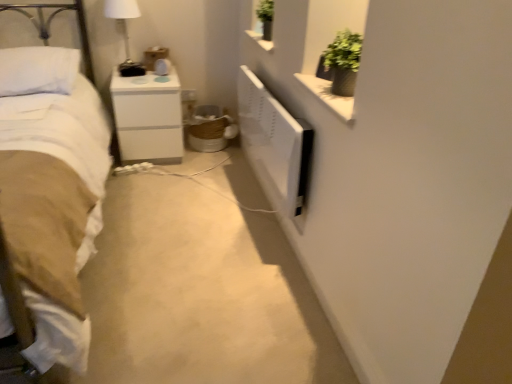
Question: Is there a large distance between white glossy nightstand at center and white soft bed at left?

Choices:
 (A) no
 (B) yes

Answer: (A)

Question: Is the surface of white glossy nightstand at center in direct contact with white soft bed at left?

Choices:
 (A) no
 (B) yes

Answer: (A)

Question: Can you confirm if white glossy nightstand at center is positioned to the left of white soft bed at left?

Choices:
 (A) yes
 (B) no

Answer: (B)

Question: Considering the relative positions of white glossy nightstand at center and white soft bed at left in the image provided, is white glossy nightstand at center behind white soft bed at left?

Choices:
 (A) no
 (B) yes

Answer: (B)

Question: Does white glossy nightstand at center have a greater width compared to white soft bed at left?

Choices:
 (A) yes
 (B) no

Answer: (B)

Question: From the image's perspective, does white glossy nightstand at center appear lower than white soft bed at left?

Choices:
 (A) no
 (B) yes

Answer: (A)

Question: Can you confirm if white glossy lampshade at upper left is taller than white soft pillow at upper left?

Choices:
 (A) yes
 (B) no

Answer: (A)

Question: From a real-world perspective, is white glossy lampshade at upper left located beneath white soft pillow at upper left?

Choices:
 (A) yes
 (B) no

Answer: (B)

Question: Does white glossy lampshade at upper left have a smaller size compared to white soft pillow at upper left?

Choices:
 (A) yes
 (B) no

Answer: (A)

Question: Can you confirm if white glossy lampshade at upper left is positioned to the left of white soft pillow at upper left?

Choices:
 (A) no
 (B) yes

Answer: (A)

Question: Is white glossy lampshade at upper left in front of white soft pillow at upper left?

Choices:
 (A) no
 (B) yes

Answer: (A)

Question: Does white glossy lampshade at upper left have a lesser width compared to white soft pillow at upper left?

Choices:
 (A) no
 (B) yes

Answer: (B)

Question: Is the surface of white glossy nightstand at center in direct contact with white glossy lampshade at upper left?

Choices:
 (A) yes
 (B) no

Answer: (B)